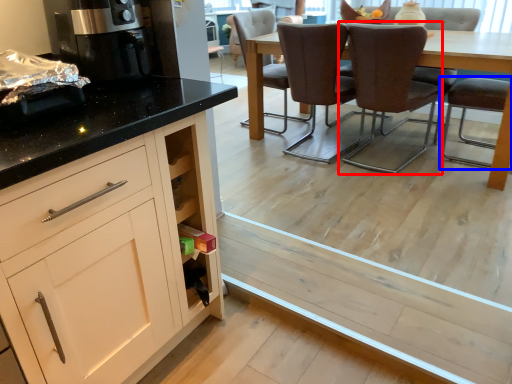
Question: Which point is closer to the camera, chair (highlighted by a red box) or chair (highlighted by a blue box)?

Choices:
 (A) chair
 (B) chair

Answer: (B)